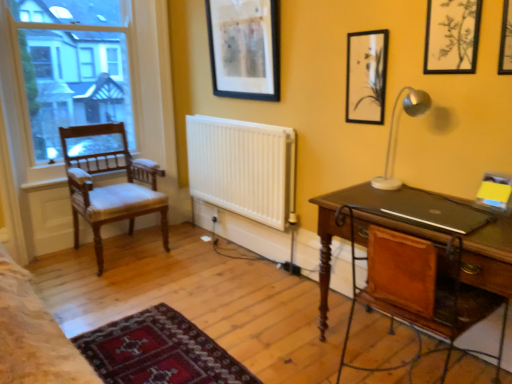
Find the location of `black matte laptop at right`. black matte laptop at right is located at coordinates (434, 211).

This screenshot has height=384, width=512. What do you see at coordinates (243, 168) in the screenshot?
I see `white matte radiator at center` at bounding box center [243, 168].

Identify the location of matte black picture frame at upper center, positioned as the fourth picture frame in front-to-back order. (244, 48).

What are the coordinates of `clear glass window at left` in the screenshot? It's located at (129, 86).

How many degrees apart are the facing directions of wooden desk at right and black matte laptop at right?

The angular difference between wooden desk at right and black matte laptop at right is 0.0435 degrees.

From a real-world perspective, between wooden desk at right and black matte laptop at right, who is vertically higher?

In real-world perspective, black matte laptop at right is above.

Is wooden desk at right closer to camera compared to black matte laptop at right?

Yes, wooden desk at right is closer to the viewer.

Which is less distant, (422, 287) or (474, 208)?

Point (422, 287).

Which object is thinner, light brown wood chair at left or black matte picture frame at upper right, the 3th picture frame viewed from the left?

black matte picture frame at upper right, the 3th picture frame viewed from the left, is thinner.

Looking at this image, does light brown wood chair at left turn towards black matte picture frame at upper right, the 3th picture frame viewed from the left?

Yes.

Is light brown wood chair at left outside of black matte picture frame at upper right, the 3th picture frame in the back-to-front sequence?

Yes, light brown wood chair at left is not within black matte picture frame at upper right, the 3th picture frame in the back-to-front sequence.

Considering the points (449, 209) and (416, 242), which point is in front, point (449, 209) or point (416, 242)?

Positioned in front is point (416, 242).

Considering the relative positions of black matte laptop at right and wooden desk at right in the image provided, is black matte laptop at right behind wooden desk at right?

That is True.

How many degrees apart are the facing directions of black matte laptop at right and wooden desk at right?

They differ by 0.0435 degrees in their facing directions.

What are the coordinates of `picture frame that is the 1st object to the right of the clear glass window at left, starting at the anchor` in the screenshot? It's located at (244, 48).

How distant is matte black picture frame at upper center, positioned as the fourth picture frame in front-to-back order, from clear glass window at left?

A distance of 86.78 centimeters exists between matte black picture frame at upper center, positioned as the fourth picture frame in front-to-back order, and clear glass window at left.

Is matte black picture frame at upper center, placed as the first picture frame when sorted from back to front, looking in the opposite direction of clear glass window at left?

matte black picture frame at upper center, placed as the first picture frame when sorted from back to front, is not turned away from clear glass window at left.

Is black matte picture frame at upper right, the second picture frame when ordered from right to left, not near light brown wood chair at left?

Yes.

How far apart are black matte picture frame at upper right, the 3th picture frame viewed from the left, and light brown wood chair at left?

The distance of black matte picture frame at upper right, the 3th picture frame viewed from the left, from light brown wood chair at left is 7.32 feet.

Consider the image. Considering the relative sizes of black matte picture frame at upper right, the 3th picture frame in the back-to-front sequence, and light brown wood chair at left in the image provided, is black matte picture frame at upper right, the 3th picture frame in the back-to-front sequence, thinner than light brown wood chair at left?

Correct, the width of black matte picture frame at upper right, the 3th picture frame in the back-to-front sequence, is less than that of light brown wood chair at left.

From the picture: Is black matte picture frame at upper right, the 3th picture frame viewed from the left, at the left side of light brown wood chair at left?

No.

From a real-world perspective, is clear glass window at left physically located above or below black matte picture frame at upper right, the 3th picture frame viewed from the left?

In terms of real-world spatial position, clear glass window at left is below black matte picture frame at upper right, the 3th picture frame viewed from the left.

From the picture: Is clear glass window at left far from black matte picture frame at upper right, acting as the 2th picture frame starting from the front?

Yes, clear glass window at left is far from black matte picture frame at upper right, acting as the 2th picture frame starting from the front.

Considering the relative sizes of clear glass window at left and black matte picture frame at upper right, acting as the 2th picture frame starting from the front, in the image provided, is clear glass window at left wider than black matte picture frame at upper right, acting as the 2th picture frame starting from the front,?

Correct, the width of clear glass window at left exceeds that of black matte picture frame at upper right, acting as the 2th picture frame starting from the front.

From the image's perspective, is matte black picture frame at upper center, placed as the first picture frame when sorted from back to front, located beneath light brown wood chair at left?

No, from the image's perspective, matte black picture frame at upper center, placed as the first picture frame when sorted from back to front, is not below light brown wood chair at left.

Considering their positions, is matte black picture frame at upper center, positioned as the fourth picture frame in front-to-back order, located in front of or behind light brown wood chair at left?

Clearly, matte black picture frame at upper center, positioned as the fourth picture frame in front-to-back order, is in front of light brown wood chair at left.

Is matte black picture frame at upper center, placed as the first picture frame when sorted from back to front, with light brown wood chair at left?

There is a gap between matte black picture frame at upper center, placed as the first picture frame when sorted from back to front, and light brown wood chair at left.

Between matte black picture frame at upper center, placed as the first picture frame when sorted from back to front, and light brown wood chair at left, which one has smaller size?

Smaller between the two is matte black picture frame at upper center, placed as the first picture frame when sorted from back to front.

The width and height of the screenshot is (512, 384). In order to click on laptop located behind the wooden desk at right in this screenshot , I will do `click(434, 211)`.

Find the location of a particular element. chair below the black matte picture frame at upper right, acting as the 2th picture frame starting from the front (from a real-world perspective) is located at coordinates (111, 186).

Looking at this image, considering their positions, is white matte radiator at center positioned closer to black matte picture frame at upper right, arranged as the 4th picture frame when viewed from the back, than matte black picture frame at upper right, which is the 2th picture frame in back-to-front order?

matte black picture frame at upper right, which is the 2th picture frame in back-to-front order, is closer to black matte picture frame at upper right, arranged as the 4th picture frame when viewed from the back.

When comparing their distances from matte black picture frame at upper right, the 3th picture frame when ordered from front to back, does white matte radiator at center or black matte picture frame at upper right, arranged as the 4th picture frame when viewed from the back, seem further?

white matte radiator at center is further to matte black picture frame at upper right, the 3th picture frame when ordered from front to back.

When comparing their distances from black matte picture frame at upper right, the 3th picture frame viewed from the left, does clear glass window at left or white matte radiator at center seem further?

Among the two, clear glass window at left is located further to black matte picture frame at upper right, the 3th picture frame viewed from the left.

Which object lies nearer to the anchor point black matte laptop at right, clear glass window at left or light brown wood chair at left?

light brown wood chair at left is positioned closer to the anchor black matte laptop at right.

From the image, which object appears to be farther from light brown wood chair at left, black matte laptop at right or white matte radiator at center?

The object further to light brown wood chair at left is black matte laptop at right.

Estimate the real-world distances between objects in this image. Which object is further from black matte picture frame at upper right, the second picture frame when ordered from right to left, black matte picture frame at upper right, arranged as the 4th picture frame when viewed from the back, or clear glass window at left?

clear glass window at left is positioned further to the anchor black matte picture frame at upper right, the second picture frame when ordered from right to left.

Which object lies further to the anchor point light brown wood chair at left, black matte picture frame at upper right, the 3th picture frame in the back-to-front sequence, or matte black picture frame at upper right, placed as the second picture frame when sorted from left to right?

black matte picture frame at upper right, the 3th picture frame in the back-to-front sequence, is further to light brown wood chair at left.

Based on their spatial positions, is matte black picture frame at upper right, which is the 2th picture frame in back-to-front order, or light brown wood chair at left further from black matte picture frame at upper right, the 3th picture frame in the back-to-front sequence?

light brown wood chair at left is positioned further to the anchor black matte picture frame at upper right, the 3th picture frame in the back-to-front sequence.

Locate an element on the screen. This screenshot has width=512, height=384. picture frame that lies between black matte picture frame at upper right, arranged as the first picture frame when viewed from the right, and wooden desk at right from top to bottom is located at coordinates click(x=366, y=76).

This screenshot has width=512, height=384. I want to click on laptop situated between light brown wood chair at left and black matte picture frame at upper right, the 3th picture frame viewed from the left, from left to right, so click(x=434, y=211).

I want to click on chair located between clear glass window at left and black matte laptop at right in the left-right direction, so click(x=111, y=186).

Where is `radiator between clear glass window at left and black matte picture frame at upper right, the 3th picture frame viewed from the left`? radiator between clear glass window at left and black matte picture frame at upper right, the 3th picture frame viewed from the left is located at coordinates (243, 168).